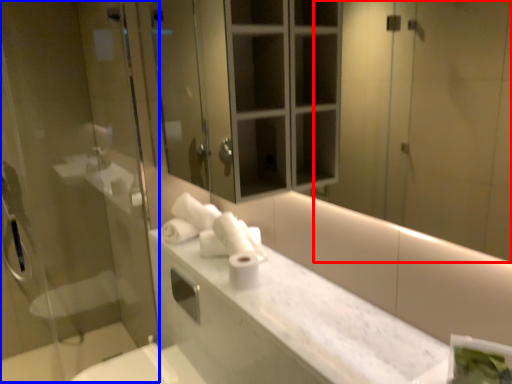
Question: Which point is closer to the camera, mirror (highlighted by a red box) or screen door (highlighted by a blue box)?

Choices:
 (A) mirror
 (B) screen door

Answer: (A)